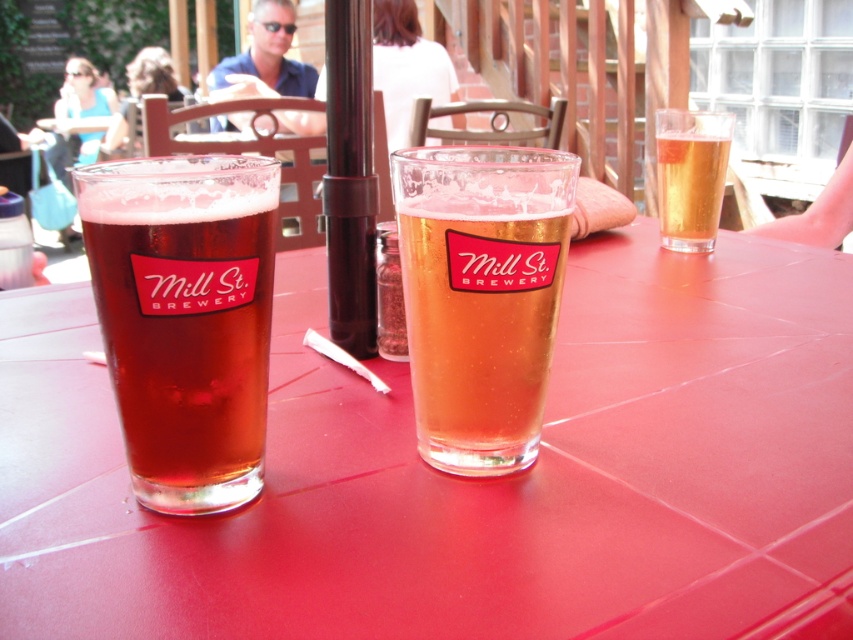
Is point (515, 156) positioned in front of point (694, 248)?

Yes, it is.

Who is more forward, (x=561, y=212) or (x=728, y=113)?

Point (x=561, y=212) is more forward.

You are a GUI agent. You are given a task and a screenshot of the screen. Output one action in this format:
    pyautogui.click(x=<x>, y=<y>)
    Task: Click on the translucent glass at center
    The height and width of the screenshot is (640, 853).
    Given the screenshot: What is the action you would take?
    pyautogui.click(x=480, y=296)

Between point (653, 572) and point (659, 168), which one is positioned behind?

The point (659, 168) is more distant.

Who is positioned more to the right, translucent glass table at center or translucent glass at upper right?

translucent glass at upper right

The image size is (853, 640). Find the location of `translucent glass table at center`. translucent glass table at center is located at coordinates (469, 477).

Between point (498, 577) and point (492, 273), which one is positioned in front?

Point (498, 577)

Who is more distant from viewer, (770, 337) or (492, 433)?

The point (770, 337) is more distant.

Find the location of a particular element. This screenshot has height=640, width=853. translucent glass table at center is located at coordinates (469, 477).